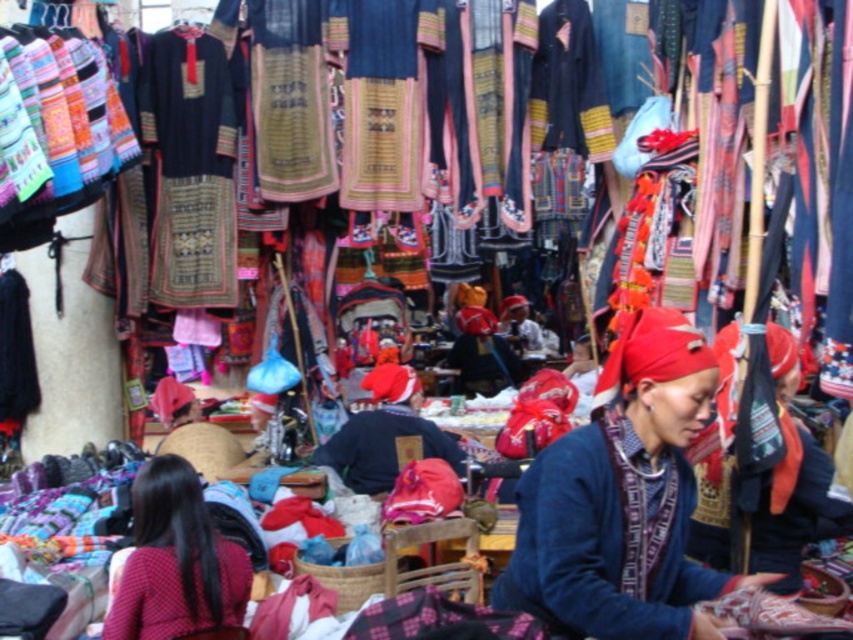
Question: Which of the following is the closest to the observer?

Choices:
 (A) (625, 467)
 (B) (218, 573)

Answer: (A)

Question: Is blue woven sweater at center thinner than red fabric headscarf at lower left?

Choices:
 (A) yes
 (B) no

Answer: (B)

Question: Is blue woven sweater at center closer to camera compared to dark blue fabric at center?

Choices:
 (A) yes
 (B) no

Answer: (A)

Question: Is blue woven sweater at center smaller than red fabric headscarf at lower left?

Choices:
 (A) no
 (B) yes

Answer: (A)

Question: Which of the following is the farthest from the observer?

Choices:
 (A) dark blue fabric at center
 (B) blue woven sweater at center

Answer: (A)

Question: Which point is farther to the camera?

Choices:
 (A) dark blue fabric at center
 (B) blue woven sweater at center
 (C) red fabric headscarf at lower left

Answer: (A)